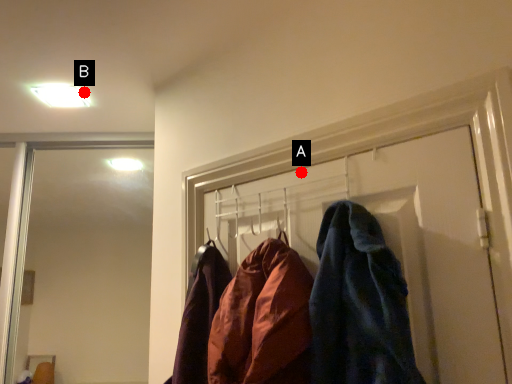
Question: Two points are circled on the image, labeled by A and B beside each circle. Which point appears farthest from the camera in this image?

Choices:
 (A) A is further
 (B) B is further

Answer: (B)